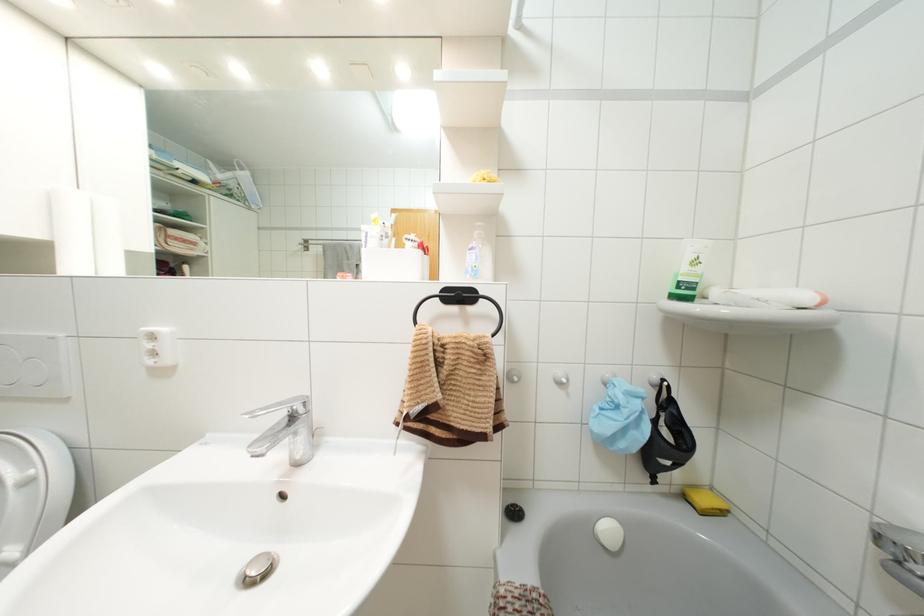
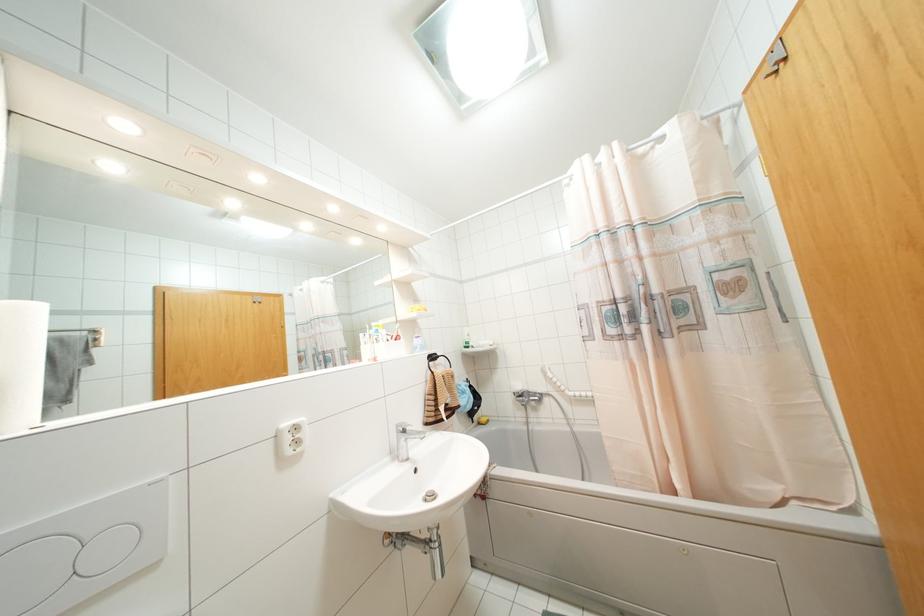
In the second image, find the point that corresponds to point 685,496 in the first image.

(479, 423)